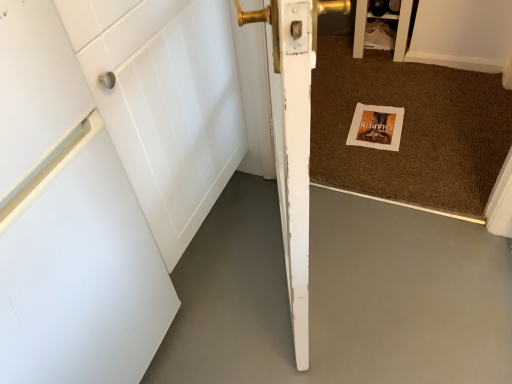
Question: Is matte white cabinet at upper right outside of white matte concrete at lower left?

Choices:
 (A) no
 (B) yes

Answer: (B)

Question: Is the depth of matte white cabinet at upper right less than that of white matte concrete at lower left?

Choices:
 (A) yes
 (B) no

Answer: (B)

Question: From the image's perspective, is matte white cabinet at upper right below white matte concrete at lower left?

Choices:
 (A) no
 (B) yes

Answer: (A)

Question: Is matte white cabinet at upper right to the right of white matte concrete at lower left from the viewer's perspective?

Choices:
 (A) yes
 (B) no

Answer: (A)

Question: Is matte white cabinet at upper right bigger than white matte concrete at lower left?

Choices:
 (A) no
 (B) yes

Answer: (A)

Question: Is matte white cabinet at upper right touching white matte concrete at lower left?

Choices:
 (A) no
 (B) yes

Answer: (A)

Question: Can you confirm if white matte concrete at lower left is bigger than gold metallic door handle at upper center?

Choices:
 (A) yes
 (B) no

Answer: (A)

Question: Are white matte concrete at lower left and gold metallic door handle at upper center far apart?

Choices:
 (A) no
 (B) yes

Answer: (B)

Question: Does white matte concrete at lower left have a lesser height compared to gold metallic door handle at upper center?

Choices:
 (A) yes
 (B) no

Answer: (A)

Question: Is gold metallic door handle at upper center inside white matte concrete at lower left?

Choices:
 (A) yes
 (B) no

Answer: (B)

Question: From the image's perspective, is white matte concrete at lower left beneath gold metallic door handle at upper center?

Choices:
 (A) yes
 (B) no

Answer: (A)

Question: From the image's perspective, is white matte concrete at lower left on top of gold metallic door handle at upper center?

Choices:
 (A) yes
 (B) no

Answer: (B)

Question: Is white paper postcard at center aimed at gold metallic door handle at upper center?

Choices:
 (A) yes
 (B) no

Answer: (B)